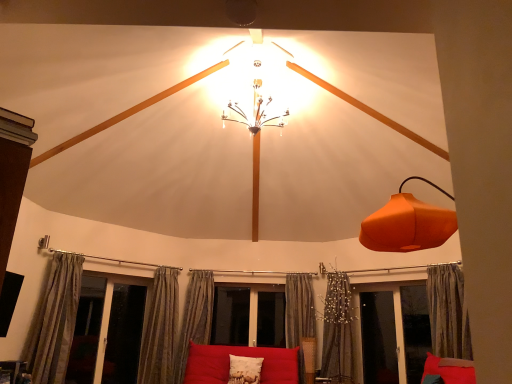
Question: Is point (75, 263) closer or farther from the camera than point (253, 375)?

Choices:
 (A) closer
 (B) farther

Answer: (A)

Question: Is textured beige curtain at left, the 6th curtain when ordered from right to left, taller or shorter than white textured pillow at center?

Choices:
 (A) short
 (B) tall

Answer: (B)

Question: Which object is positioned closest to the silky beige curtain at lower left, the second curtain from the left?

Choices:
 (A) silky gray curtain at lower center, the fifth curtain when ordered from left to right
 (B) silky gray curtain at center, acting as the third curtain starting from the right
 (C) transparent glass screen door at lower right, arranged as the second screen door when viewed from the left
 (D) transparent glass screen door at lower right, marked as the 3th screen door in a left-to-right arrangement
 (E) orange matte lampshade at right

Answer: (B)

Question: Estimate the real-world distances between objects in this image. Which object is closer to the transparent glass screen door at lower right, which is the first screen door in right-to-left order?

Choices:
 (A) textured beige curtain at left, positioned as the first curtain in left-to-right order
 (B) white textured pillow at center
 (C) transparent glass screen door at lower right, which appears as the 2th screen door when viewed from the right
 (D) silky beige curtain at lower left, positioned as the fifth curtain in right-to-left order
 (E) matte red couch at center

Answer: (C)